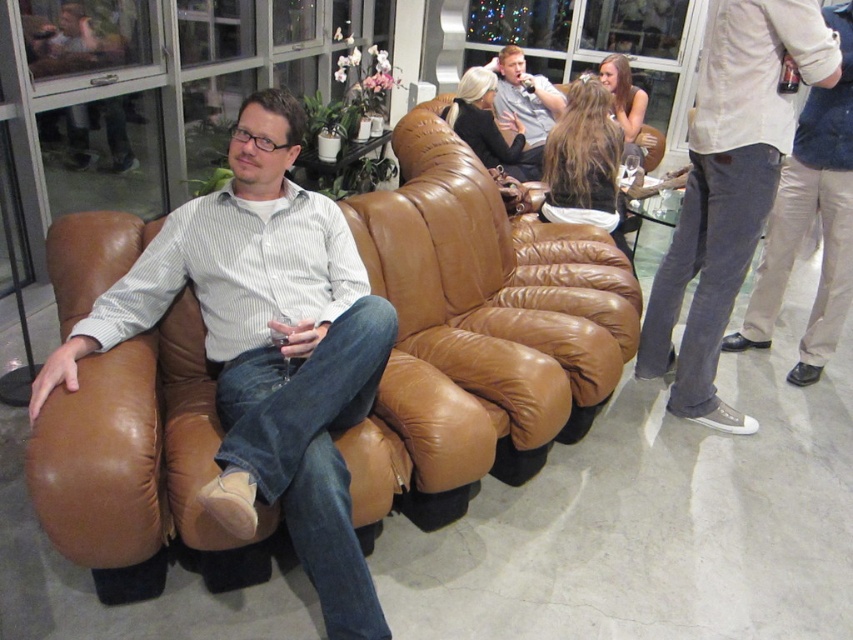
You are a photographer at the event and want to capture a photo of the matte gray shirt at upper center without the light gray jeans at right blocking it. Is this possible based on their positions?

The light gray jeans at right is in front of the matte gray shirt at upper center, so it would block the view. To capture the matte gray shirt at upper center without obstruction, you would need to reposition yourself or the subjects to ensure the light gray jeans at right is not in front.

You are a guest at this event and want to sit down. You see the matte brown leather couch at left and the light beige pants at right. Which object is lower in height?

The matte brown leather couch at left is shorter than the light beige pants at right, so the matte brown leather couch at left is lower in height.

You are a delivery person holding a package that requires a 1.5 meter clearance to maneuver. You need to navigate around the matte brown leather couch at left. Is there enough space to move around it without hitting the couch?

The matte brown leather couch at left is 1.40 meters away from the camera, so the 1.5 meter clearance required for the package is slightly more than the available space. Therefore, there might not be enough space to maneuver around the couch without risking a collision.